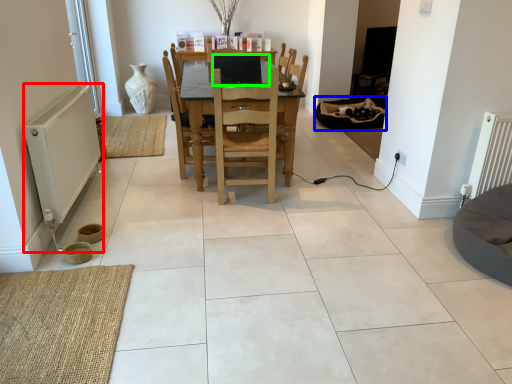
Question: Which object is positioned farthest from appliance (highlighted by a red box)? Select from bean bag chair (highlighted by a blue box) and computer (highlighted by a green box).

Choices:
 (A) bean bag chair
 (B) computer

Answer: (A)